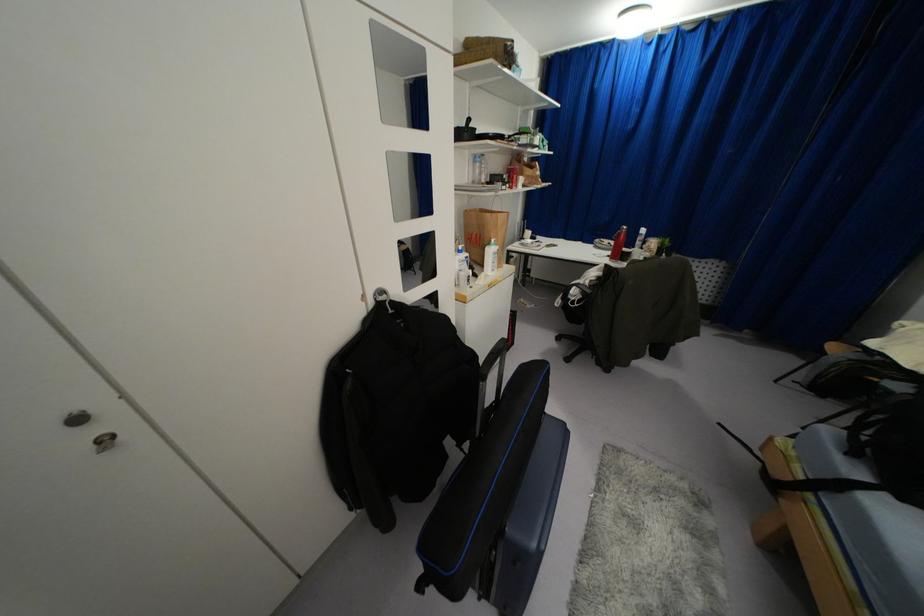
What do you see at coordinates (103, 440) in the screenshot? The width and height of the screenshot is (924, 616). I see `the recessed cabinet handle` at bounding box center [103, 440].